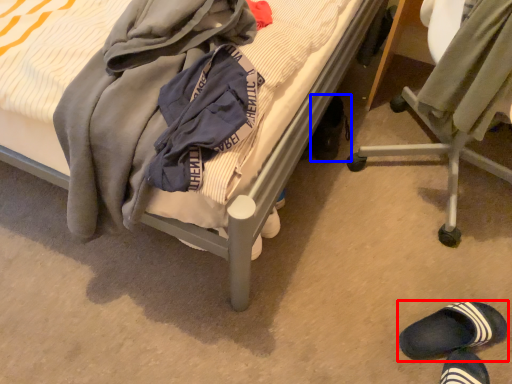
Question: Which point is closer to the camera, footwear (highlighted by a red box) or footwear (highlighted by a blue box)?

Choices:
 (A) footwear
 (B) footwear

Answer: (A)